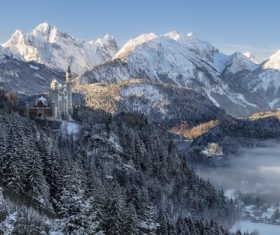
This screenshot has height=235, width=280. What are the coordinates of `wall` in the screenshot? It's located at (52, 110).